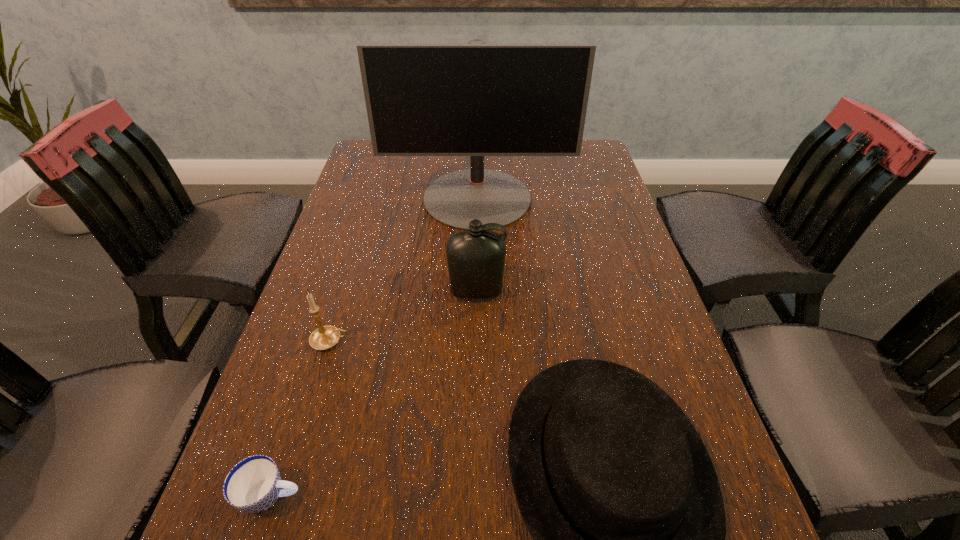
Locate an element on the screen. The width and height of the screenshot is (960, 540). vacant space at the right edge of the desktop is located at coordinates (676, 379).

The image size is (960, 540). I want to click on vacant space at the far left corner of the desktop, so click(369, 165).

In the image, there is a desktop. Where is `vacant space at the far right corner`? The height and width of the screenshot is (540, 960). vacant space at the far right corner is located at coordinates (573, 171).

Identify the location of vacant space that's between the candle holder and the shortest object. (300, 418).

Identify the location of blank region between the cup and the third shortest object. This screenshot has height=540, width=960. (300, 418).

Locate an element on the screen. The image size is (960, 540). vacant space in between the second farthest object and the shortest object is located at coordinates (373, 394).

Identify which object is the nearest to the fourth nearest object. Please provide its 2D coordinates. Your answer should be formatted as a tuple, i.e. [(x, y)], where the tuple contains the x and y coordinates of a point satisfying the conditions above.

[(615, 486)]

Identify which object is the nearest to the second tallest object. Please provide its 2D coordinates. Your answer should be formatted as a tuple, i.e. [(x, y)], where the tuple contains the x and y coordinates of a point satisfying the conditions above.

[(615, 486)]

The height and width of the screenshot is (540, 960). Find the location of `free space in the image that satisfies the following two spatial constraints: 1. on the front side of the second farthest object; 2. on the handle side of the candle holder`. free space in the image that satisfies the following two spatial constraints: 1. on the front side of the second farthest object; 2. on the handle side of the candle holder is located at coordinates (476, 341).

You are a GUI agent. You are given a task and a screenshot of the screen. Output one action in this format:
    pyautogui.click(x=<x>, y=<y>)
    Task: Click on the free location that satisfies the following two spatial constraints: 1. on the screen of the tallest object; 2. on the handle side of the third nearest object
    
    Given the screenshot: What is the action you would take?
    pyautogui.click(x=476, y=341)